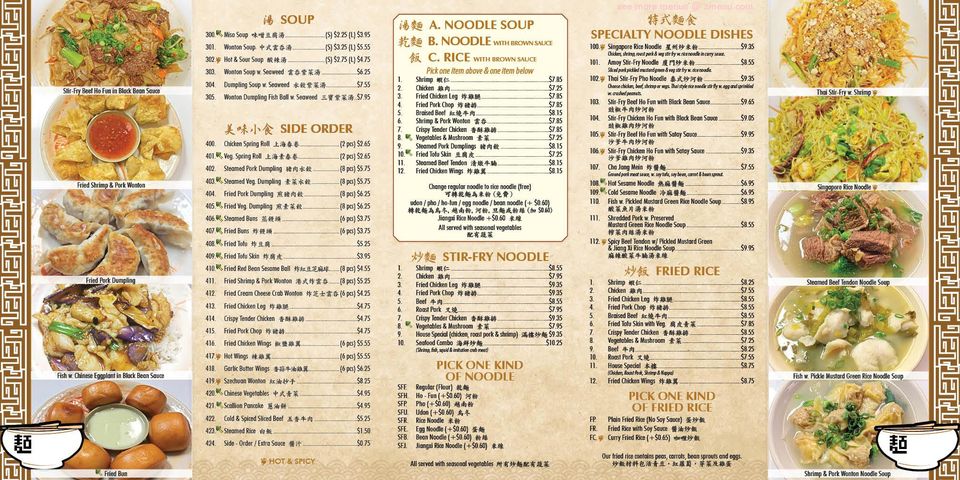
At what (x,y) coordinates should I click in order to perform the action: click on photos of dishes. Please return your answer as a coordinate pair (x, y). Looking at the image, I should click on (111, 29), (96, 134), (98, 236), (108, 318), (109, 426), (817, 412), (829, 323), (826, 236), (813, 105), (817, 54).